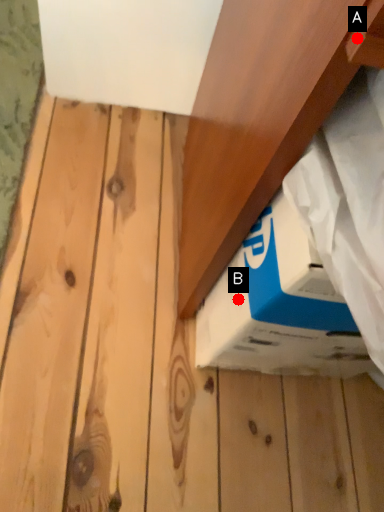
Question: Two points are circled on the image, labeled by A and B beside each circle. Which of the following is the farthest from the observer?

Choices:
 (A) A is further
 (B) B is further

Answer: (B)